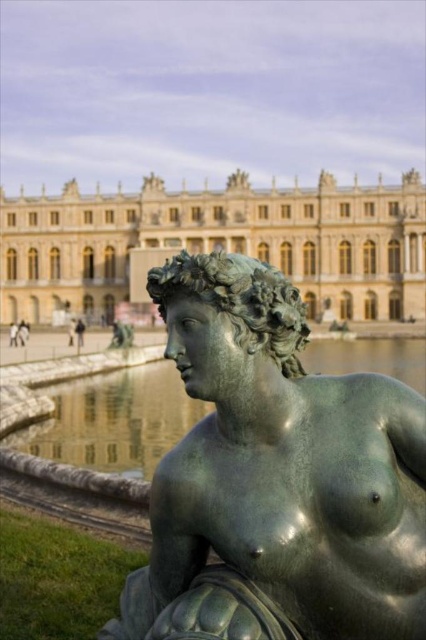
You are standing in the garden and want to take a photo of the green patina statue at center. If your camera has a maximum zoom range of 100 feet, will you be able to capture the statue clearly without moving closer?

The green patina statue at center is 173.39 feet away from the viewer. Since the camera can only zoom up to 100 feet, you won cannot capture the statue clearly without moving closer.